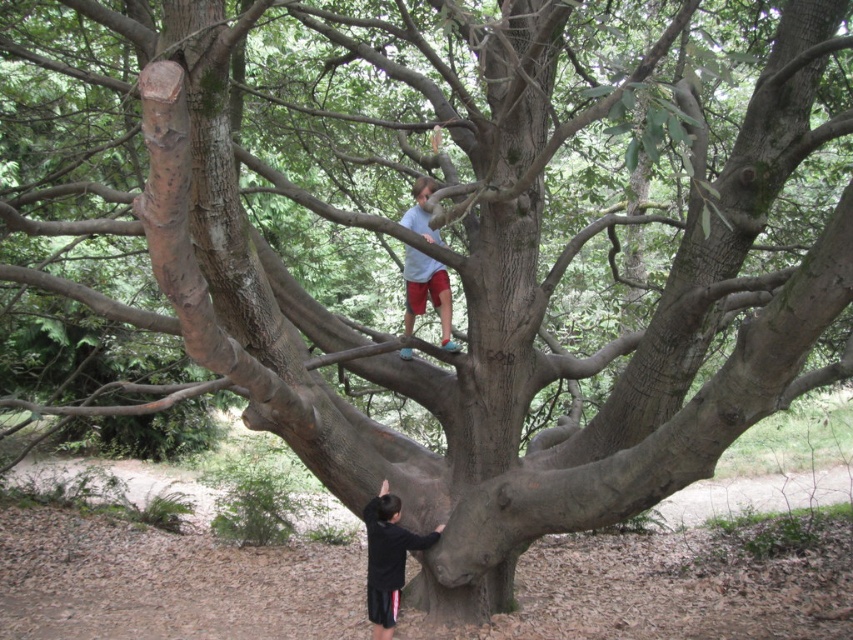
Who is more forward, (393, 568) or (437, 243)?

Positioned in front is point (393, 568).

What do you see at coordinates (387, 557) in the screenshot? I see `black matte shirt at lower center` at bounding box center [387, 557].

This screenshot has height=640, width=853. Find the location of `black matte shirt at lower center`. black matte shirt at lower center is located at coordinates (387, 557).

Locate an element on the screen. black matte shirt at lower center is located at coordinates (387, 557).